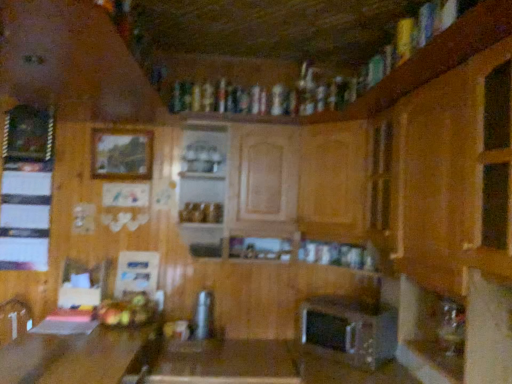
Question: In terms of height, does satin silver toaster at lower center, marked as the 2th appliance in a left-to-right arrangement, look taller or shorter compared to wooden table at lower left, which is the first table from left to right?

Choices:
 (A) tall
 (B) short

Answer: (B)

Question: From the image's perspective, is satin silver toaster at lower center, marked as the 2th appliance in a left-to-right arrangement, positioned above or below wooden table at lower left, which is the first table from left to right?

Choices:
 (A) below
 (B) above

Answer: (B)

Question: Which is nearer to the satin silver toaster at lower center, marked as the 2th appliance in a left-to-right arrangement?

Choices:
 (A) wooden picture frame at upper left, which is the second picture frame in left-to-right order
 (B) metallic silver toaster at center, placed as the first appliance when sorted from left to right
 (C) shiny metallic fruit basket at lower center
 (D) wooden table at lower left, which is the first table from left to right
 (E) wooden table at center, marked as the 1th table in a right-to-left arrangement

Answer: (E)

Question: Which object is positioned closest to the wooden picture frame at upper left, which appears as the 2th picture frame when viewed from the right?

Choices:
 (A) metallic silver toaster at center, placed as the first appliance when sorted from left to right
 (B) shiny metallic fruit basket at lower center
 (C) wooden picture frame at upper left, the first picture frame in the right-to-left sequence
 (D) wooden table at lower left, which ranks as the second table in right-to-left order
 (E) wooden table at center, marked as the 1th table in a right-to-left arrangement

Answer: (C)